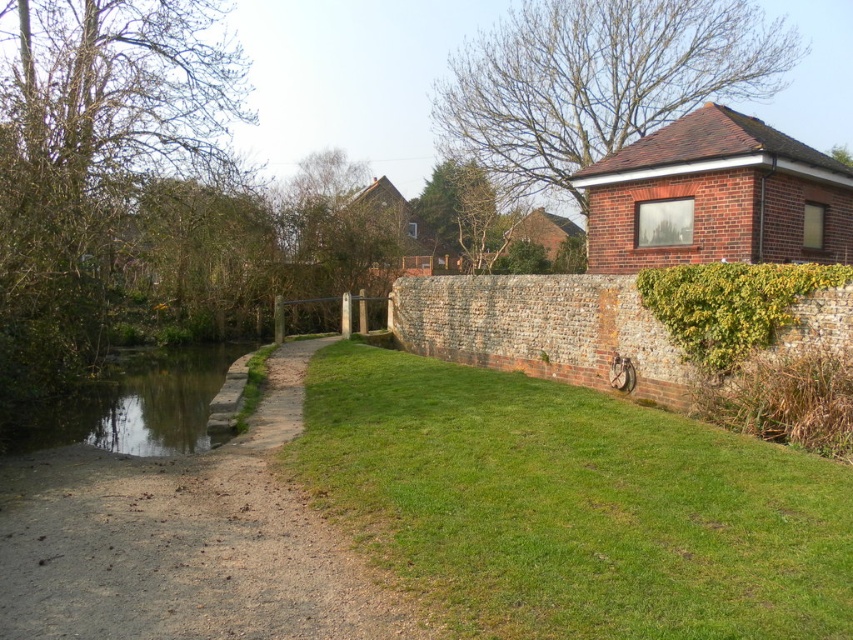
Question: Where is green grass at lower center located in relation to dull brown gravel at center-left in the image?

Choices:
 (A) below
 (B) above

Answer: (B)

Question: Based on their relative distances, which object is nearer to the green leafy hedge at right?

Choices:
 (A) dull brown gravel at center-left
 (B) green grass at lower center
 (C) greenish-brown concrete at left

Answer: (B)

Question: Observing the image, what is the correct spatial positioning of dull brown gravel at center-left in reference to green leafy hedge at right?

Choices:
 (A) below
 (B) above

Answer: (A)

Question: Which object appears closest to the camera in this image?

Choices:
 (A) green leafy hedge at right
 (B) green grass at lower center
 (C) greenish-brown concrete at left

Answer: (B)

Question: Among these points, which one is nearest to the camera?

Choices:
 (A) (809, 285)
 (B) (248, 486)
 (C) (144, 381)

Answer: (B)

Question: Can you confirm if green grass at lower center is bigger than dull brown gravel at center-left?

Choices:
 (A) no
 (B) yes

Answer: (A)